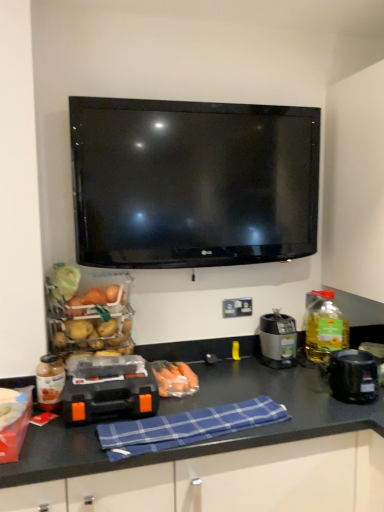
Question: Is translucent glass bottle at left, which is the second bottle in back-to-front order, facing towards blue plaid cloth at center?

Choices:
 (A) yes
 (B) no

Answer: (B)

Question: From a real-world perspective, is translucent glass bottle at left, the second bottle when ordered from right to left, located beneath blue plaid cloth at center?

Choices:
 (A) yes
 (B) no

Answer: (B)

Question: Is the position of translucent glass bottle at left, marked as the 1th bottle in a front-to-back arrangement, more distant than that of blue plaid cloth at center?

Choices:
 (A) no
 (B) yes

Answer: (B)

Question: Is translucent glass bottle at left, the second bottle when ordered from right to left, to the right of blue plaid cloth at center from the viewer's perspective?

Choices:
 (A) no
 (B) yes

Answer: (A)

Question: Can you confirm if translucent glass bottle at left, which is the second bottle in back-to-front order, is thinner than blue plaid cloth at center?

Choices:
 (A) no
 (B) yes

Answer: (B)

Question: Based on their positions, is black plastic coffee maker at right, positioned as the 3th appliance in left-to-right order, located to the left or right of matte plastic basket of vegetables at left, positioned as the 2th food in bottom-to-top order?

Choices:
 (A) right
 (B) left

Answer: (A)

Question: Is point (360, 356) positioned closer to the camera than point (81, 335)?

Choices:
 (A) closer
 (B) farther

Answer: (A)

Question: Choose the correct answer: Is black plastic coffee maker at right, which appears as the 1th appliance when viewed from the right, inside matte plastic basket of vegetables at left, which appears as the second food when viewed from the right, or outside it?

Choices:
 (A) outside
 (B) inside

Answer: (A)

Question: Considering the positions of black plastic coffee maker at right, the second appliance when ordered from back to front, and matte plastic basket of vegetables at left, which appears as the second food when viewed from the right, in the image, is black plastic coffee maker at right, the second appliance when ordered from back to front, taller or shorter than matte plastic basket of vegetables at left, which appears as the second food when viewed from the right,?

Choices:
 (A) tall
 (B) short

Answer: (B)

Question: Looking at the image, does translucent glass bottle at left, which is counted as the first bottle, starting from the left, seem bigger or smaller compared to white plastic electrical outlet at center?

Choices:
 (A) small
 (B) big

Answer: (B)

Question: Is translucent glass bottle at left, which is the second bottle in back-to-front order, to the left or to the right of white plastic electrical outlet at center in the image?

Choices:
 (A) right
 (B) left

Answer: (B)

Question: From a real-world perspective, relative to white plastic electrical outlet at center, is translucent glass bottle at left, which is the second bottle in back-to-front order, vertically above or below?

Choices:
 (A) above
 (B) below

Answer: (B)

Question: Considering the positions of point (44, 364) and point (241, 303), is point (44, 364) closer or farther from the camera than point (241, 303)?

Choices:
 (A) farther
 (B) closer

Answer: (B)

Question: Considering their positions, is translucent plastic carrots at center, which is counted as the first food, starting from the right, located in front of or behind matte plastic basket of vegetables at left, which appears as the second food when viewed from the right?

Choices:
 (A) front
 (B) behind

Answer: (B)

Question: Is translucent plastic carrots at center, the second food from the left, to the left or to the right of matte plastic basket of vegetables at left, acting as the first food starting from the left, in the image?

Choices:
 (A) left
 (B) right

Answer: (B)